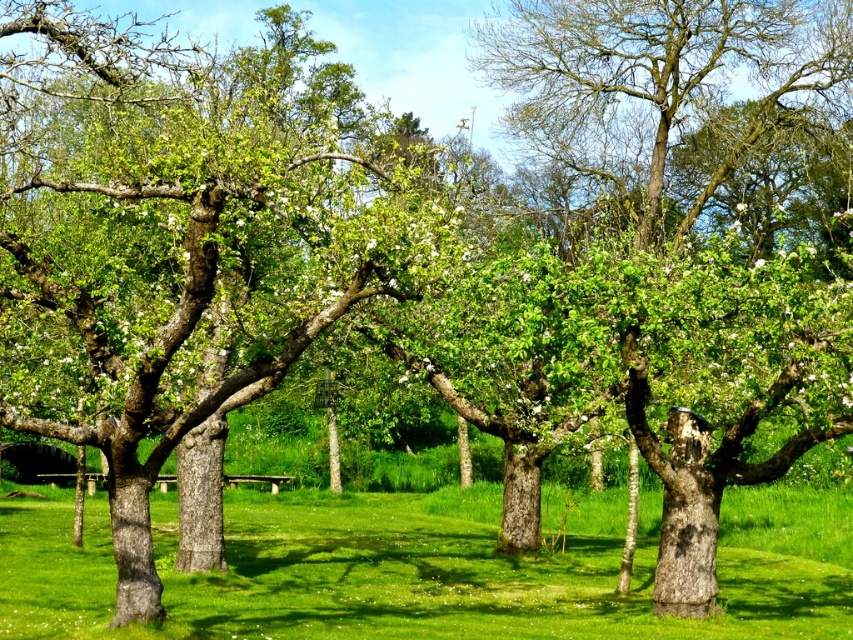
You are standing in the orchard and want to sit on the green grass at center. To reach it, you must walk past the green rough bark tree at center. Which direction should you move relative to the tree to get to the grass?

Since the green rough bark tree at center is closer to the viewer than the green grass at center, you should move forward past the green rough bark tree at center to reach the green grass at center.